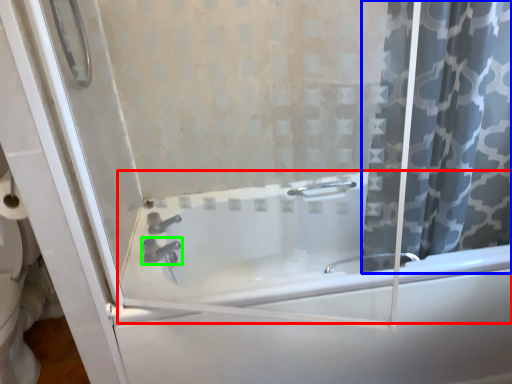
Question: Which object is positioned closest to bathtub (highlighted by a red box)? Select from curtain (highlighted by a blue box) and tap (highlighted by a green box).

Choices:
 (A) curtain
 (B) tap

Answer: (A)